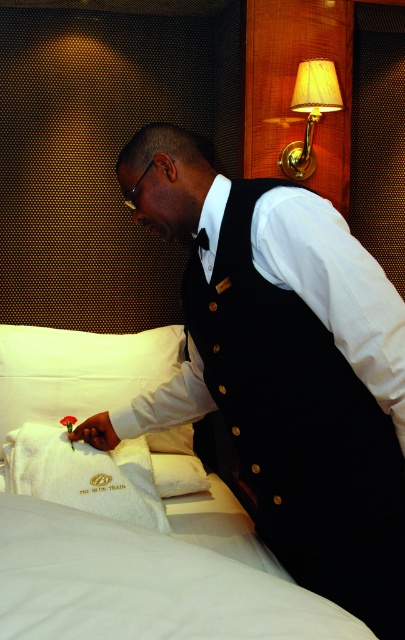
Can you confirm if white embroidered towel at lower left is shorter than beige fabric lamp at upper right?

Correct, white embroidered towel at lower left is not as tall as beige fabric lamp at upper right.

The height and width of the screenshot is (640, 405). What are the coordinates of `white embroidered towel at lower left` in the screenshot? It's located at (83, 474).

Which is above, white soft pillow at center or beige fabric lamp at upper right?

beige fabric lamp at upper right is higher up.

Which of these two, white soft pillow at center or beige fabric lamp at upper right, stands shorter?

Standing shorter between the two is beige fabric lamp at upper right.

Which is behind, point (170, 332) or point (300, 160)?

Positioned behind is point (170, 332).

What are the coordinates of `white soft pillow at center` in the screenshot? It's located at (78, 371).

Can you confirm if black satin vest at center is positioned to the right of white embroidered towel at lower left?

Indeed, black satin vest at center is positioned on the right side of white embroidered towel at lower left.

Is black satin vest at center below white embroidered towel at lower left?

No.

Is point (319, 344) in front of point (162, 522)?

Yes, it is.

The width and height of the screenshot is (405, 640). Find the location of `black satin vest at center`. black satin vest at center is located at coordinates (281, 369).